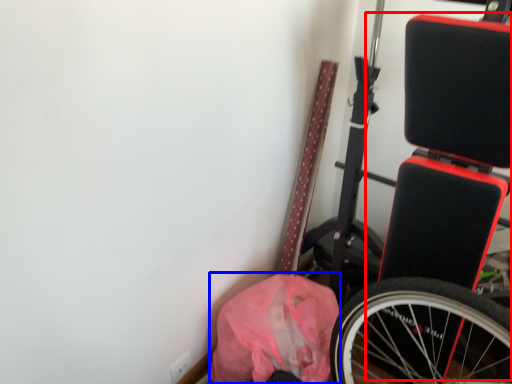
Question: Which object appears closest to the camera in this image, wide (highlighted by a red box) or material (highlighted by a blue box)?

Choices:
 (A) wide
 (B) material

Answer: (A)